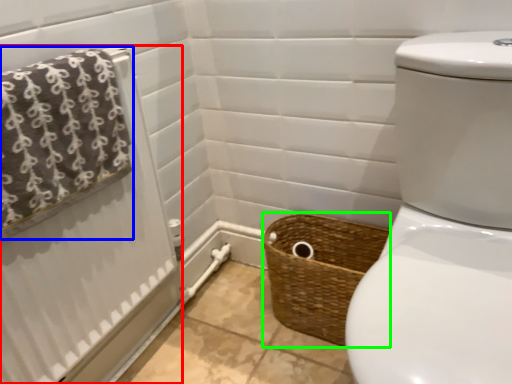
Question: Estimate the real-world distances between objects in this image. Which object is farther from shower curtain (highlighted by a red box), bath towel (highlighted by a blue box) or basket (highlighted by a green box)?

Choices:
 (A) bath towel
 (B) basket

Answer: (B)